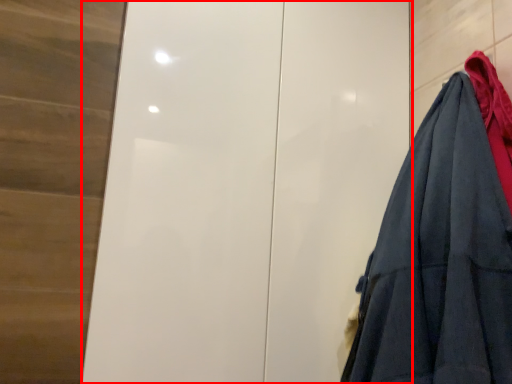
Question: Considering the relative positions of door (annotated by the red box) and garment in the image provided, where is door (annotated by the red box) located with respect to the staircase?

Choices:
 (A) left
 (B) right

Answer: (A)